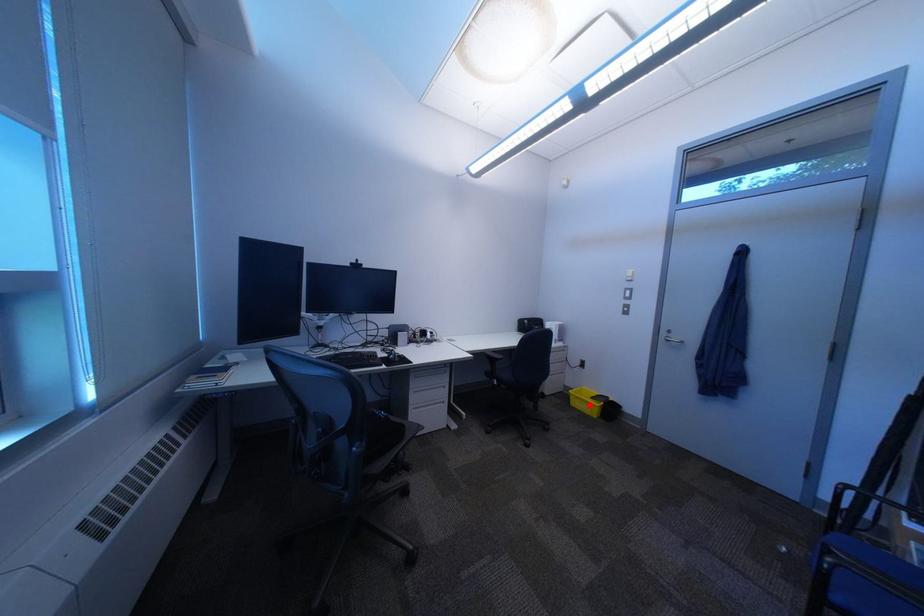
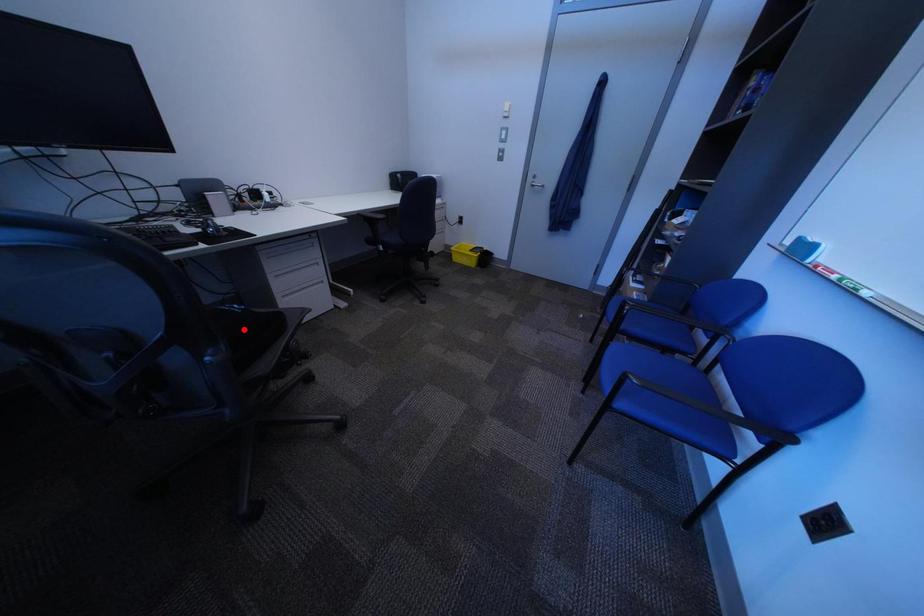
I am providing you with two images of the same scene from different viewpoints. A red point is marked on the first image and another point is marked on the second image. Is the marked point in image1 the same physical position as the marked point in image2?

No